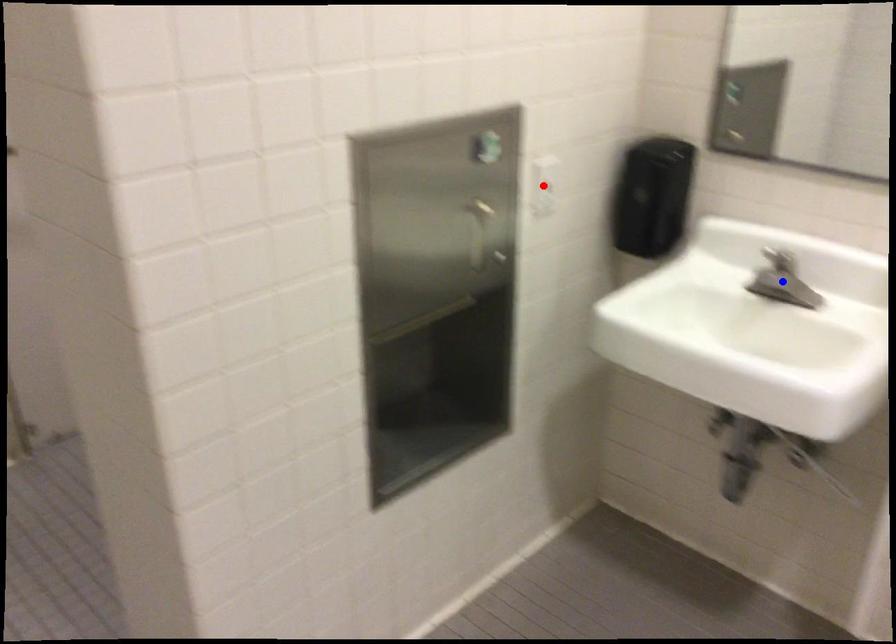
Question: In the image, two points are highlighted. Which point is nearer to the camera? Reply with the corresponding letter.

Choices:
 (A) blue point
 (B) red point

Answer: (A)